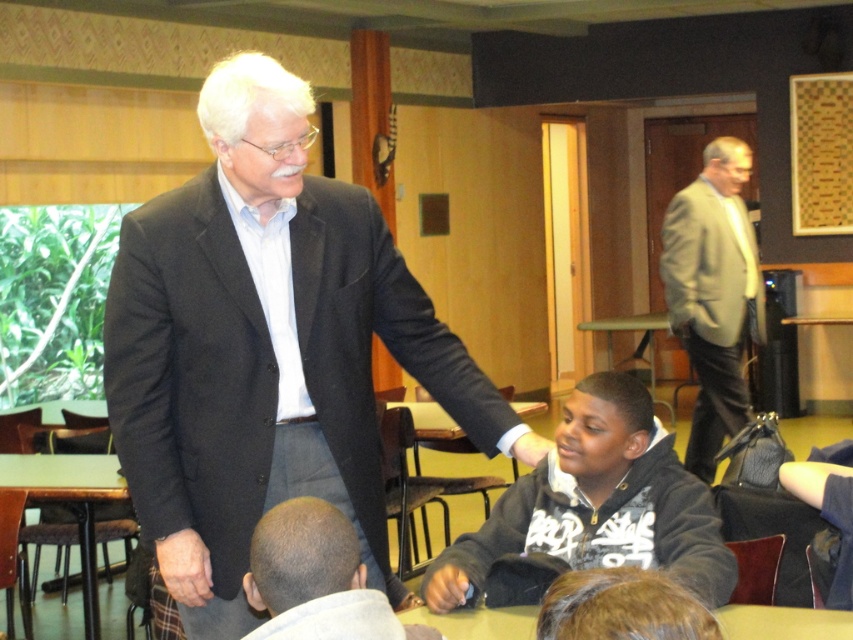
You are a photographer trying to capture a candid shot of the light gray suit at right and the wooden table at lower left. Since you want to ensure both subjects are in focus, you need to know their vertical positions. Can you determine which one is higher from the ground?

The light gray suit at right is above the wooden table at lower left, so the light gray suit at right is higher from the ground.

You are standing at the center of the room and want to place a small plant exactly at the point marked as point (712, 294). The light gray suit at right is occupying that area. Can you place the plant there without moving the light gray suit at right?

The point (712, 294) is occupied by the light gray suit at right, so you cannot place the plant there without moving the light gray suit at right.

You are standing in the community center and need to find the dark gray suit at center. According to the scene description, where should you look to locate it?

The dark gray suit at center is located at point (267, 349).